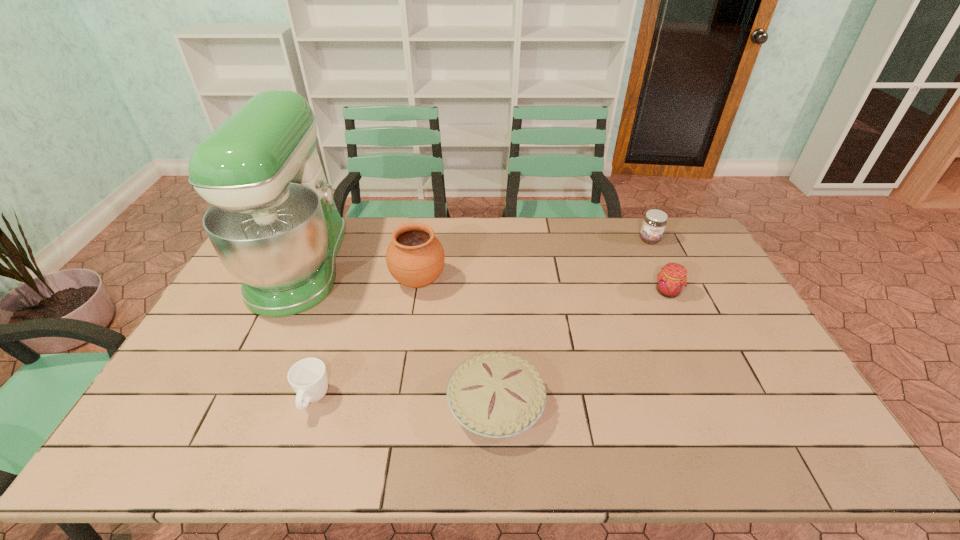
Identify the location of free space between the nearer jam and the cup. (491, 346).

This screenshot has height=540, width=960. I want to click on empty space that is in between the pottery and the cup, so [366, 340].

Where is `empty location between the tallest object and the pie`? The width and height of the screenshot is (960, 540). empty location between the tallest object and the pie is located at coordinates (398, 335).

Find the location of a particular element. vacant space that's between the shorter jam and the cup is located at coordinates (491, 346).

Identify the location of free space between the third object from right to left and the pottery. Image resolution: width=960 pixels, height=540 pixels. [457, 343].

The image size is (960, 540). Identify the location of object that is the closest to the nearer jam. (654, 223).

At what (x,y) coordinates should I click in order to perform the action: click on object that is the fifth nearest to the pie. Please return your answer as a coordinate pair (x, y). The image size is (960, 540). Looking at the image, I should click on (654, 223).

You are a GUI agent. You are given a task and a screenshot of the screen. Output one action in this format:
    pyautogui.click(x=<x>, y=<y>)
    Task: Click on the vacant space that satisfies the following two spatial constraints: 1. on the controls of the shorter jam; 2. on the right side of the tallest object
    
    Given the screenshot: What is the action you would take?
    pyautogui.click(x=288, y=292)

Where is `vacant space that satisfies the following two spatial constraints: 1. on the controls of the tallest object; 2. on the right side of the pottery`? This screenshot has height=540, width=960. vacant space that satisfies the following two spatial constraints: 1. on the controls of the tallest object; 2. on the right side of the pottery is located at coordinates (293, 281).

I want to click on free space that satisfies the following two spatial constraints: 1. on the front label of the farther jam; 2. on the controls of the mixer, so click(x=662, y=266).